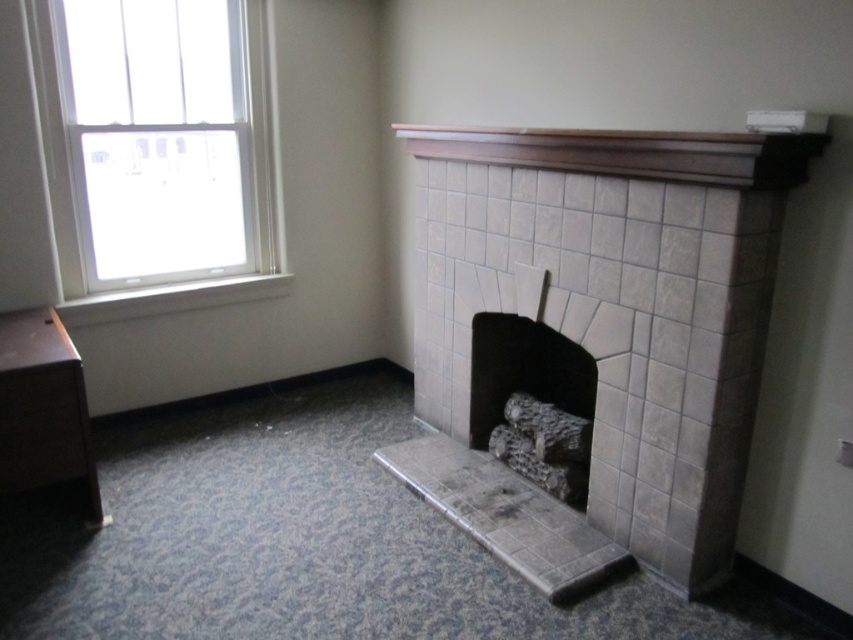
Looking at this image, you are a painter who needs to hang a 3.5 feet wide painting between the white glass window at upper left and the brown wood mantle at upper center. Can the painting fit in the space between them?

The distance between the white glass window at upper left and the brown wood mantle at upper center is 4.43 feet, which is wider than the 3.5 feet wide painting. Therefore, the painting can fit in the space between them.

You are standing in the room depicted in the scene. There is a point marked at coordinates (630, 152). What object is located at that point?

The point at coordinates (630, 152) marks the brown wood mantle at upper center.